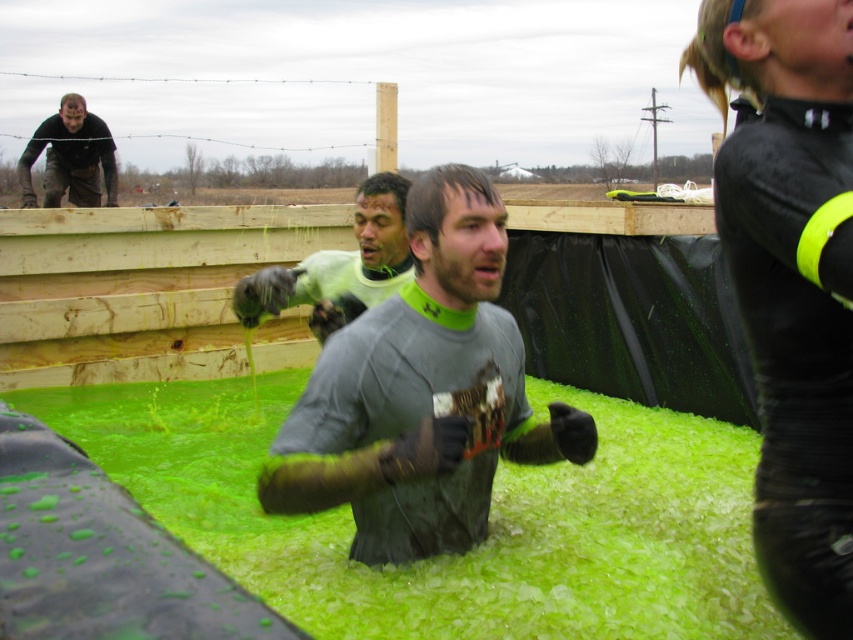
Question: Can you confirm if green slime at center is positioned above green matte shirt at center?

Choices:
 (A) yes
 (B) no

Answer: (B)

Question: Among these points, which one is nearest to the camera?

Choices:
 (A) (506, 371)
 (B) (86, 131)
 (C) (294, 560)
 (D) (247, 307)

Answer: (A)

Question: Does green slime at center appear over gray matte shirt at center?

Choices:
 (A) yes
 (B) no

Answer: (B)

Question: Which point is farther to the camera?

Choices:
 (A) green matte shirt at center
 (B) matte black shirt at upper left

Answer: (B)

Question: Does gray matte shirt at center have a greater width compared to green matte shirt at center?

Choices:
 (A) yes
 (B) no

Answer: (A)

Question: Which object is the closest to the green matte shirt at center?

Choices:
 (A) green slime at center
 (B) gray matte shirt at center

Answer: (B)